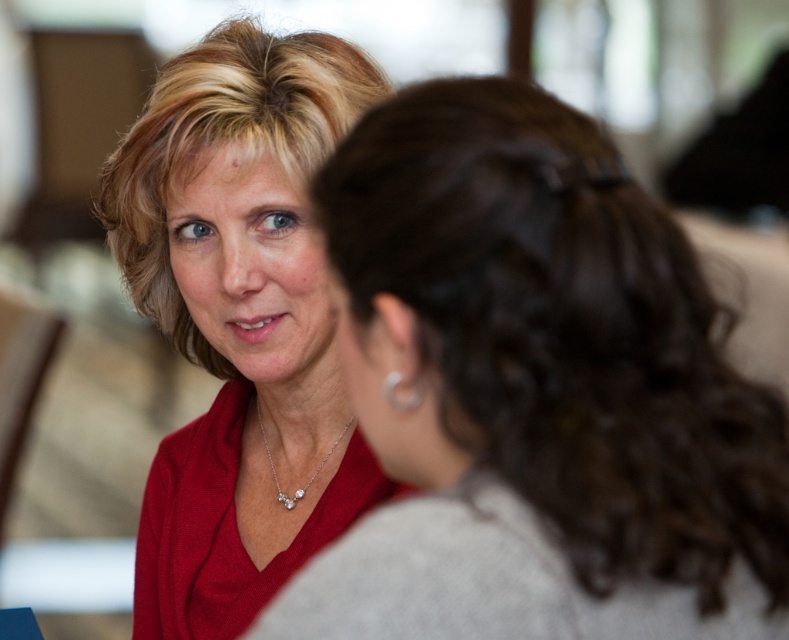
What color is the blouse located at the point with coordinates (535,392)?

The blouse at point (535,392) is matte red.

You are a photographer trying to capture a candid shot of the two people in the scene. The photographer is standing at the point marked by the coordinate point at point [690,276]. The photographer wants to ensure that both individuals are in frame without any part of them being cut off. Given that the camera has a standard 50mm lens with a 46 degree angle of view, will the photographer be able to fit both people in the frame?

The two individuals are 26.88 inches apart. With a 50mm lens and a 46 degree angle of view, the field of view at the photographer distance would allow capturing subjects within approximately 26 inches. Since the distance between them is slightly larger than the field of view, the photographer might need to step back slightly or use a wider lens to ensure both are fully in frame.

You are standing in front of a painting that shows two people talking. You notice two objects labeled as the matte red blouse at upper left and the matte red blouse at center. Which one is nearer to you?

The matte red blouse at upper left is closer to the viewer than the matte red blouse at center.